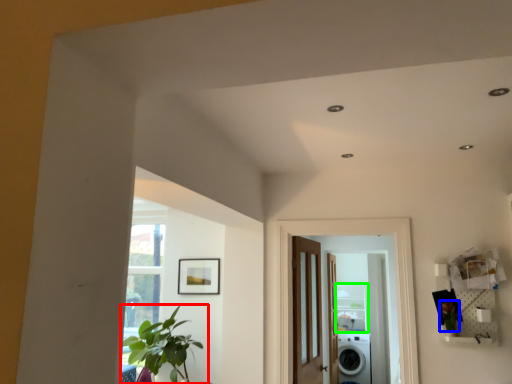
Question: Which is nearer to the houseplant (highlighted by a red box)? plant (highlighted by a blue box) or shelf (highlighted by a green box).

Choices:
 (A) plant
 (B) shelf

Answer: (A)